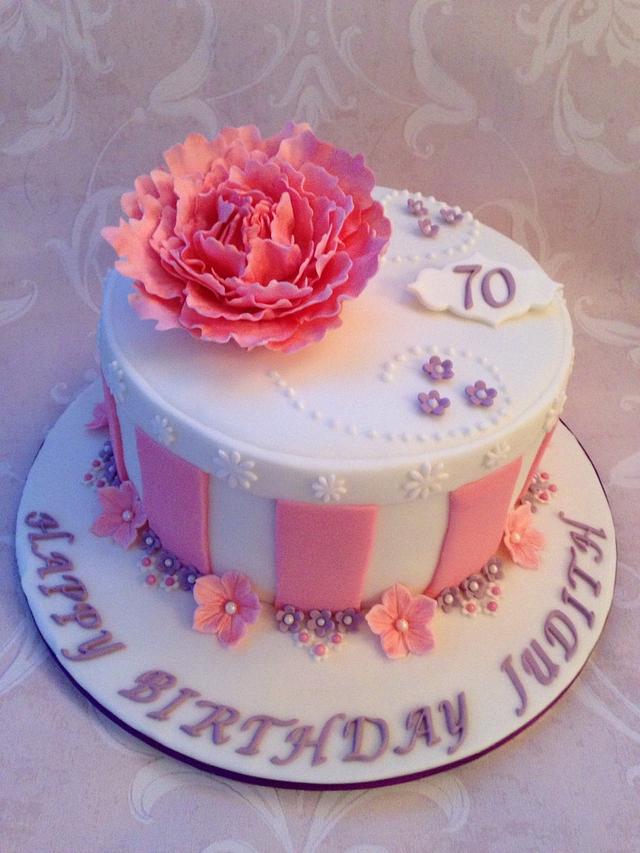
The width and height of the screenshot is (640, 853). Find the location of `birthday cake`. birthday cake is located at coordinates click(344, 356).